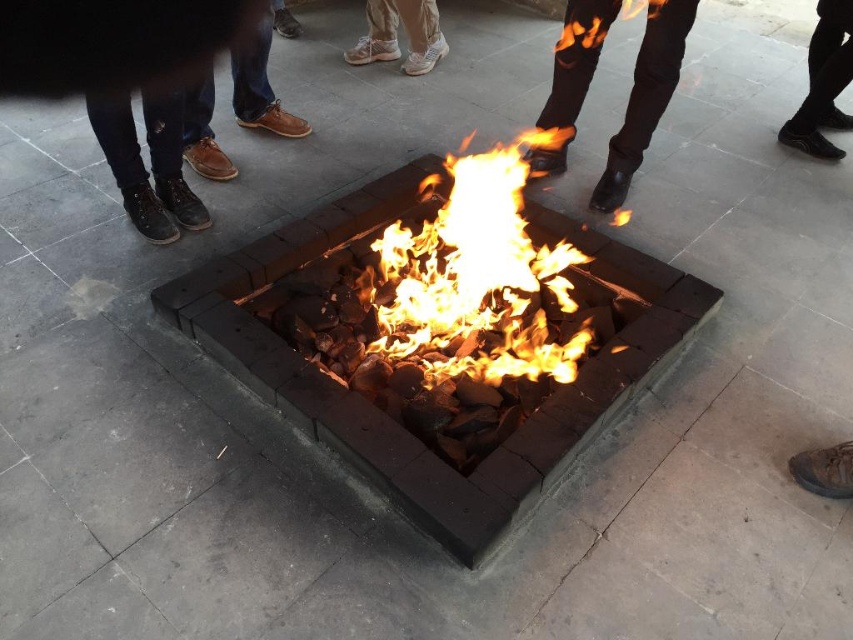
Question: Is black leather shoes at right positioned before white mesh sneakers at center?

Choices:
 (A) yes
 (B) no

Answer: (A)

Question: Is brown leather shoes at left closer to camera compared to white mesh sneakers at center?

Choices:
 (A) no
 (B) yes

Answer: (B)

Question: Does flaming wood at center lie in front of white mesh sneakers at center?

Choices:
 (A) yes
 (B) no

Answer: (A)

Question: Which point is farther to the camera?

Choices:
 (A) leather boots at center
 (B) brown leather shoe at lower right

Answer: (A)

Question: Which point appears closest to the camera in this image?

Choices:
 (A) (680, 36)
 (B) (433, 60)
 (C) (592, 291)
 (D) (807, 52)

Answer: (C)

Question: Which object is the farthest from the leather boots at center?

Choices:
 (A) black leather shoes at right
 (B) brown leather shoe at lower right
 (C) flaming wood at center

Answer: (B)